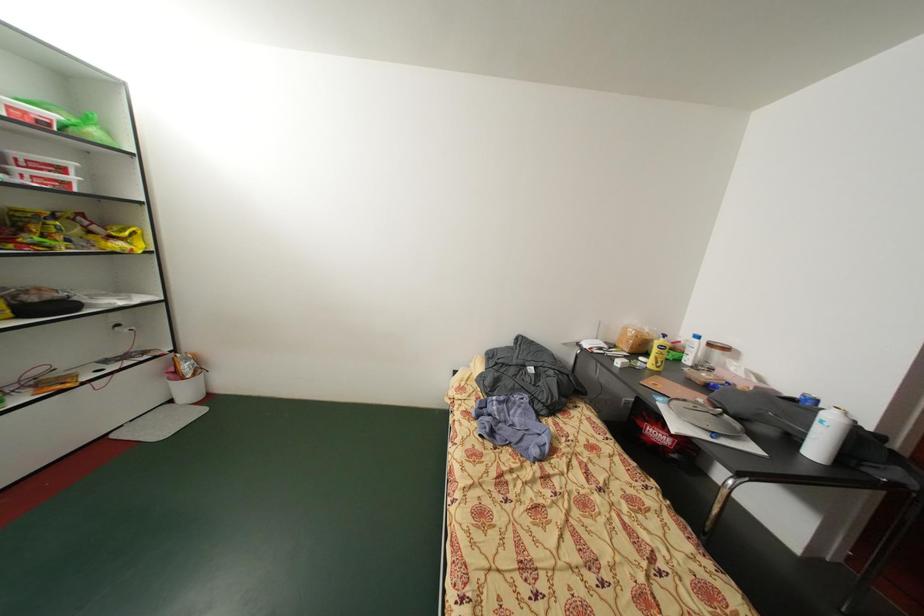
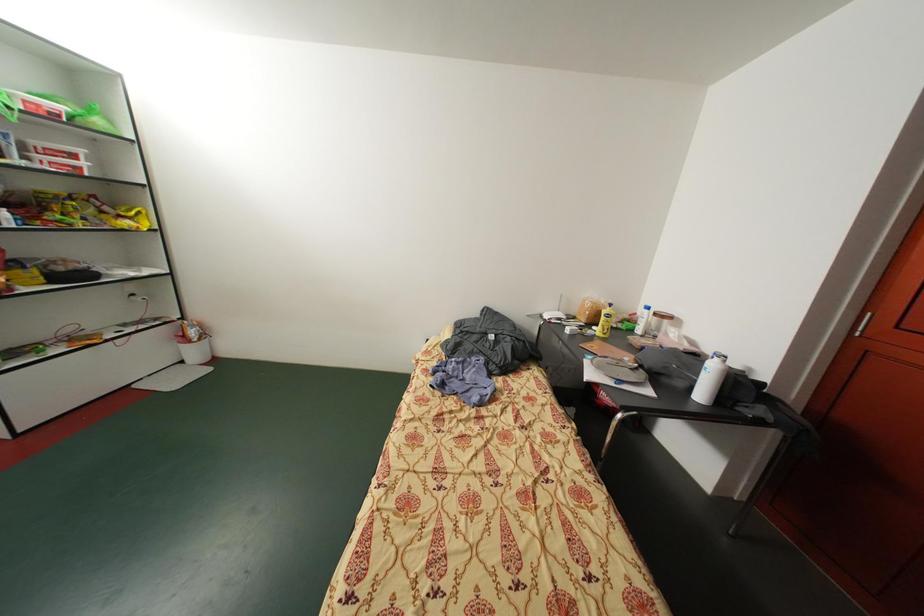
Which direction would the cameraman need to move to produce the second image?

The cameraman walked toward right, backward.